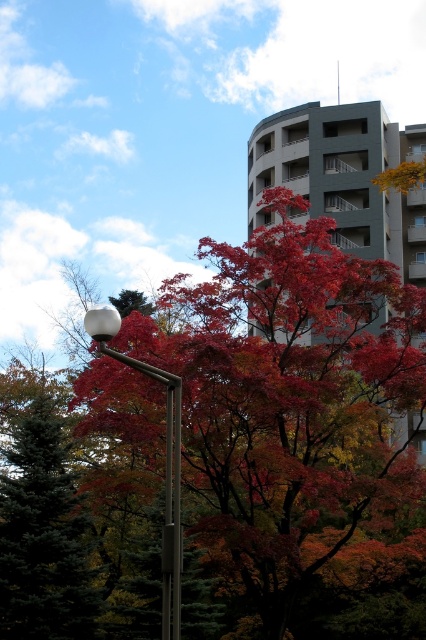
Question: Is the position of gray concrete building at center more distant than that of white glossy lamp post at center-left?

Choices:
 (A) no
 (B) yes

Answer: (B)

Question: Is shiny red leaves at center wider than green matte tree at left?

Choices:
 (A) yes
 (B) no

Answer: (A)

Question: Which point is farther to the camera?

Choices:
 (A) (264, 170)
 (B) (178, 625)

Answer: (A)

Question: Is shiny red leaves at center wider than gray concrete building at center?

Choices:
 (A) yes
 (B) no

Answer: (B)

Question: Estimate the real-world distances between objects in this image. Which object is closer to the white glossy lamp post at center-left?

Choices:
 (A) green matte tree at left
 (B) shiny red leaves at center
 (C) gray concrete building at center

Answer: (B)

Question: Among these objects, which one is nearest to the camera?

Choices:
 (A) white glossy lamp post at center-left
 (B) gray concrete building at center

Answer: (A)